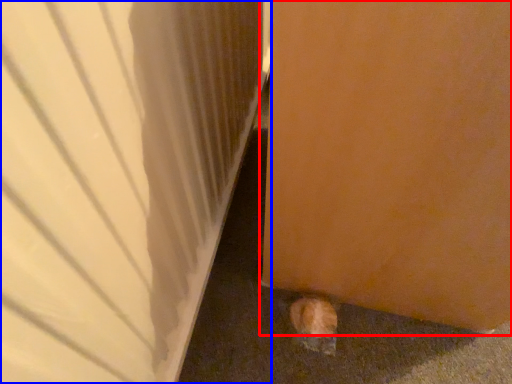
Question: Among these objects, which one is nearest to the camera, door (highlighted by a red box) or door (highlighted by a blue box)?

Choices:
 (A) door
 (B) door

Answer: (B)